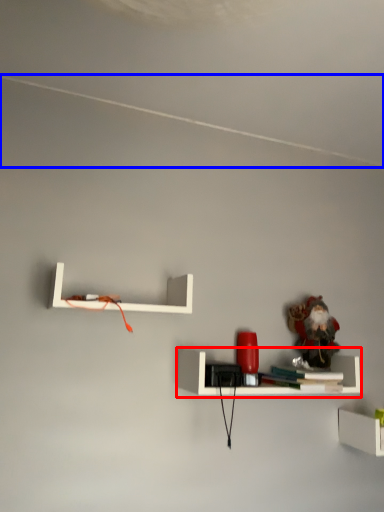
Question: Which object appears farthest to the camera in this image, shelf (highlighted by a red box) or line (highlighted by a blue box)?

Choices:
 (A) shelf
 (B) line

Answer: (A)